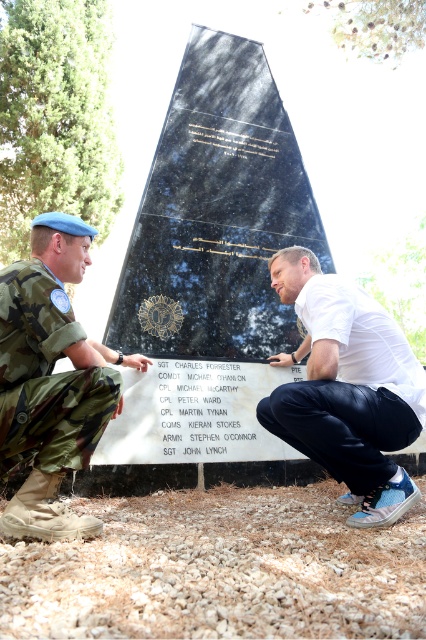
You are taking a photo of the memorial structure and notice two points marked in the image. The first point is at coordinate point (8, 416) and the second point is at coordinate point (400, 506). Which point is closer to your camera lens?

Point (8, 416) is closer to the camera lens than point (400, 506).

You are a photographer trying to capture a clear photo of the white matte shirt at center. However, the camo uniform at left is blocking your view. Can you move around to the side to get an unobstructed shot?

The camo uniform at left is in front of the white matte shirt at center, so moving to the side might allow you to capture the white matte shirt at center without obstruction.